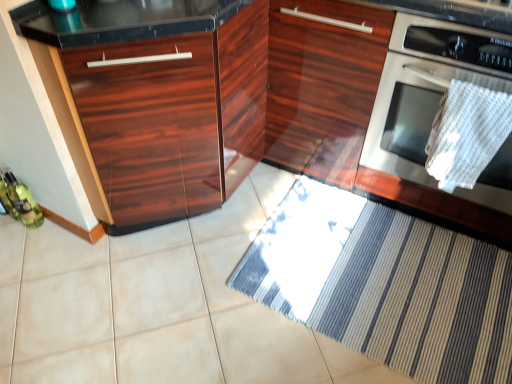
At what (x,y) coordinates should I click in order to perform the action: click on vacant area that lies between green glass bottle at lower left and striped fabric doormat at lower center. Please return your answer as a coordinate pair (x, y). This screenshot has width=512, height=384. Looking at the image, I should click on (203, 254).